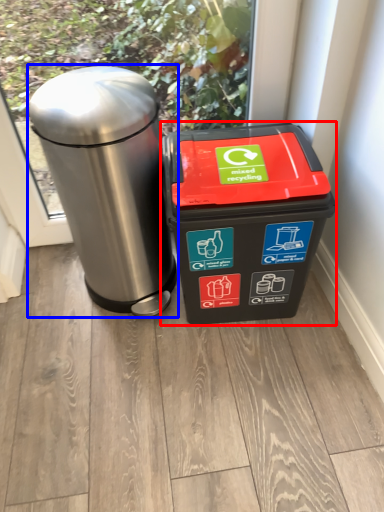
Question: Which object is further to the camera taking this photo, waste container (highlighted by a red box) or waste container (highlighted by a blue box)?

Choices:
 (A) waste container
 (B) waste container

Answer: (A)